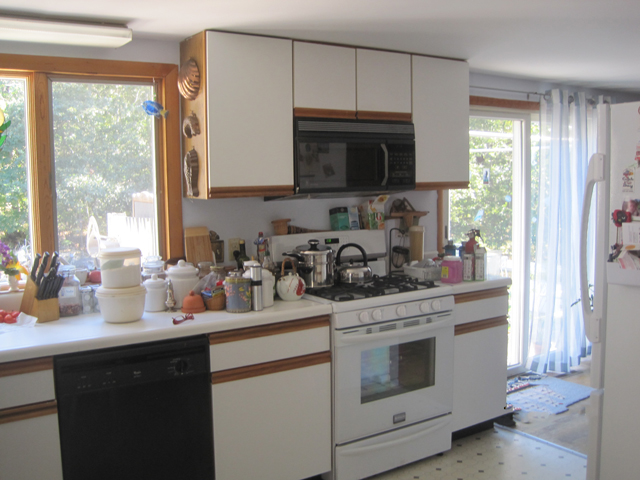
You are a GUI agent. You are given a task and a screenshot of the screen. Output one action in this format:
    pyautogui.click(x=<x>, y=<y>)
    Task: Click on the curtain
    Image resolution: width=640 pixels, height=480 pixels.
    Given the screenshot: What is the action you would take?
    pyautogui.click(x=544, y=176)